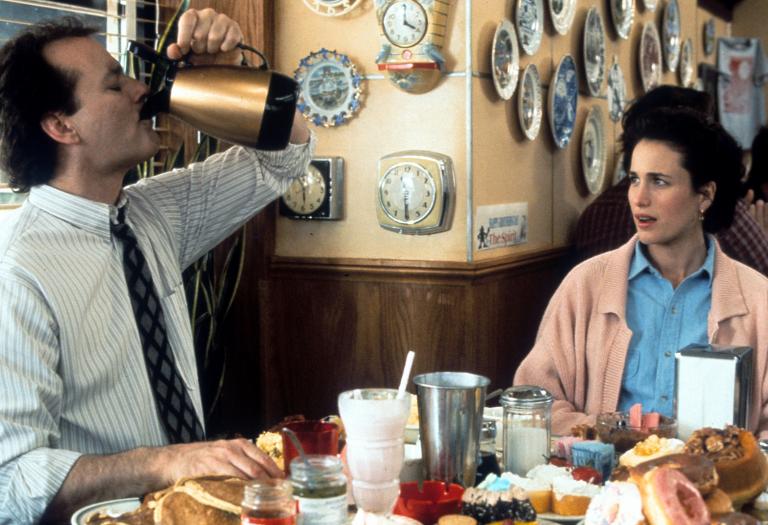
You are a GUI agent. You are given a task and a screenshot of the screen. Output one action in this format:
    pyautogui.click(x=<x>, y=<y>)
    Task: Click on the clocks
    This screenshot has height=525, width=768.
    Given the screenshot: What is the action you would take?
    pyautogui.click(x=406, y=21), pyautogui.click(x=425, y=175), pyautogui.click(x=310, y=200)